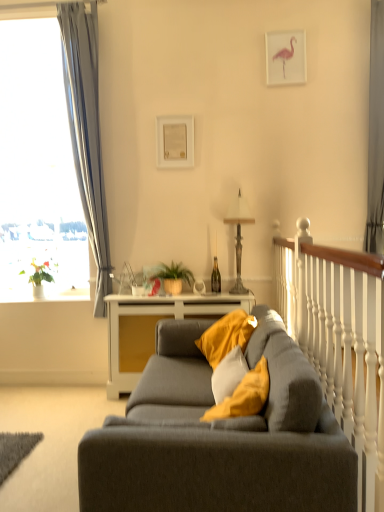
Question: Can you confirm if white wood table at center is thinner than white paper at upper center, which is the 1th picture frame from left to right?

Choices:
 (A) yes
 (B) no

Answer: (B)

Question: Does white wood table at center have a greater width compared to white paper at upper center, which is the 1th picture frame from left to right?

Choices:
 (A) no
 (B) yes

Answer: (B)

Question: From the image's perspective, would you say white wood table at center is positioned over white paper at upper center, which is the 2th picture frame in top-to-bottom order?

Choices:
 (A) yes
 (B) no

Answer: (B)

Question: From the image's perspective, is white wood table at center beneath white paper at upper center, the first picture frame viewed from the back?

Choices:
 (A) no
 (B) yes

Answer: (B)

Question: Does white wood table at center lie in front of white paper at upper center, which is the 2th picture frame in top-to-bottom order?

Choices:
 (A) no
 (B) yes

Answer: (B)

Question: Is white wood table at center to the left of white paper at upper center, which appears as the 1th picture frame when ordered from the bottom, from the viewer's perspective?

Choices:
 (A) no
 (B) yes

Answer: (A)

Question: Is soft yellow cushion at center at the left side of white paper at upper center, which appears as the 1th picture frame when ordered from the bottom?

Choices:
 (A) no
 (B) yes

Answer: (A)

Question: Is soft yellow cushion at center beside white paper at upper center, which ranks as the second picture frame in right-to-left order?

Choices:
 (A) no
 (B) yes

Answer: (A)

Question: Does soft yellow cushion at center have a smaller size compared to white paper at upper center, which ranks as the second picture frame in right-to-left order?

Choices:
 (A) yes
 (B) no

Answer: (B)

Question: Is soft yellow cushion at center facing towards white paper at upper center, which appears as the 1th picture frame when ordered from the bottom?

Choices:
 (A) no
 (B) yes

Answer: (A)

Question: Is white paper at upper center, which is the 2th picture frame in top-to-bottom order, a part of soft yellow cushion at center?

Choices:
 (A) no
 (B) yes

Answer: (A)

Question: Considering the relative sizes of soft yellow cushion at center and white paper at upper center, which is the 1th picture frame from left to right, in the image provided, is soft yellow cushion at center wider than white paper at upper center, which is the 1th picture frame from left to right,?

Choices:
 (A) no
 (B) yes

Answer: (B)

Question: Is matte gray couch at center oriented away from soft yellow cushion at center?

Choices:
 (A) no
 (B) yes

Answer: (B)